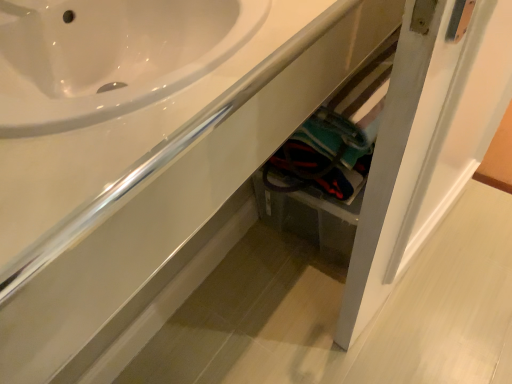
Describe the element at coordinates (137, 122) in the screenshot. The width and height of the screenshot is (512, 384). I see `white glossy sink at upper left` at that location.

At what (x,y) coordinates should I click in order to perform the action: click on white glossy sink at upper left. Please return your answer as a coordinate pair (x, y). The width and height of the screenshot is (512, 384). Looking at the image, I should click on (137, 122).

The height and width of the screenshot is (384, 512). Describe the element at coordinates (397, 158) in the screenshot. I see `white glossy door at lower right` at that location.

Find the location of `white glossy door at lower right`. white glossy door at lower right is located at coordinates (397, 158).

What are the coordinates of `white glossy sink at upper left` in the screenshot? It's located at (137, 122).

Which object is positioned more to the left, white glossy door at lower right or white glossy sink at upper left?

Positioned to the left is white glossy sink at upper left.

Which object is more forward, white glossy door at lower right or white glossy sink at upper left?

white glossy sink at upper left is more forward.

Looking at this image, which is nearer, [445,55] or [63,75]?

The point [445,55] is more forward.

From the image's perspective, relative to white glossy sink at upper left, is white glossy door at lower right above or below?

Based on their image positions, white glossy door at lower right is located beneath white glossy sink at upper left.

From a real-world perspective, which is physically above, white glossy door at lower right or white glossy sink at upper left?

From a 3D spatial view, white glossy sink at upper left is above.

Looking at this image, considering the sizes of objects white glossy door at lower right and white glossy sink at upper left in the image provided, who is wider, white glossy door at lower right or white glossy sink at upper left?

A: Wider between the two is white glossy sink at upper left.

Considering the relative sizes of white glossy door at lower right and white glossy sink at upper left in the image provided, is white glossy door at lower right taller than white glossy sink at upper left?

Yes, white glossy door at lower right is taller than white glossy sink at upper left.

In terms of size, does white glossy door at lower right appear bigger or smaller than white glossy sink at upper left?

Clearly, white glossy door at lower right is larger in size than white glossy sink at upper left.

Would you say white glossy door at lower right is outside white glossy sink at upper left?

Yes, white glossy door at lower right is outside of white glossy sink at upper left.

Is white glossy door at lower right directly adjacent to white glossy sink at upper left?

No.

Could you tell me if white glossy door at lower right is facing white glossy sink at upper left?

No.

At what (x,y) coordinates should I click in order to perform the action: click on door below the white glossy sink at upper left (from the image's perspective). Please return your answer as a coordinate pair (x, y). Looking at the image, I should click on (397, 158).

Is white glossy sink at upper left at the left side of white glossy door at lower right?

Correct, you'll find white glossy sink at upper left to the left of white glossy door at lower right.

Which is in front, white glossy sink at upper left or white glossy door at lower right?

white glossy sink at upper left.

Which point is more distant from viewer, [68,40] or [409,74]?

The point [68,40] is behind.

Consider the image. From the image's perspective, would you say white glossy sink at upper left is shown under white glossy door at lower right?

No.

From a real-world perspective, is white glossy sink at upper left above or below white glossy door at lower right?

From a real-world perspective, white glossy sink at upper left is physically above white glossy door at lower right.

Is white glossy sink at upper left thinner than white glossy door at lower right?

No.

Does white glossy sink at upper left have a greater height compared to white glossy door at lower right?

No, white glossy sink at upper left is not taller than white glossy door at lower right.

From the picture: Is white glossy sink at upper left bigger than white glossy door at lower right?

No.

Would you say white glossy sink at upper left is outside white glossy door at lower right?

Absolutely, white glossy sink at upper left is external to white glossy door at lower right.

Is white glossy sink at upper left in contact with white glossy door at lower right?

There is a gap between white glossy sink at upper left and white glossy door at lower right.

Is white glossy sink at upper left facing away from white glossy door at lower right?

No, white glossy door at lower right is not at the back of white glossy sink at upper left.

This screenshot has height=384, width=512. What are the coordinates of `door below the white glossy sink at upper left (from the image's perspective)` in the screenshot? It's located at (397, 158).

The height and width of the screenshot is (384, 512). I want to click on door to the right of white glossy sink at upper left, so click(397, 158).

Find the location of `counter top in front of the white glossy door at lower right`. counter top in front of the white glossy door at lower right is located at coordinates (137, 122).